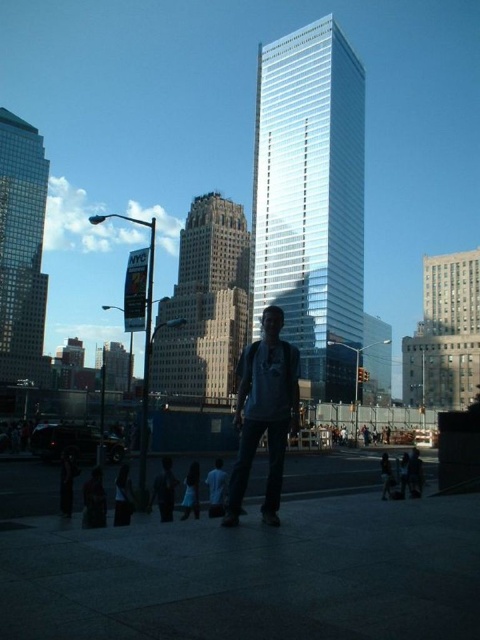
Question: Is glassy silver skyscraper at center wider than shiny glass skyscraper at left?

Choices:
 (A) no
 (B) yes

Answer: (B)

Question: Among these objects, which one is farthest from the camera?

Choices:
 (A) gray cotton t-shirt at center
 (B) glassy silver skyscraper at center
 (C) brown stone building at center
 (D) shiny glass skyscraper at left

Answer: (D)

Question: Can you confirm if brown stone building at center is positioned to the left of gray concrete building at right?

Choices:
 (A) no
 (B) yes

Answer: (B)

Question: Which object is farther from the camera taking this photo?

Choices:
 (A) gray cotton t-shirt at center
 (B) brown stone building at center
 (C) gray concrete building at right

Answer: (B)

Question: Which object appears farthest from the camera in this image?

Choices:
 (A) gray cotton t-shirt at center
 (B) glassy silver skyscraper at center
 (C) gray concrete building at right
 (D) shiny glass skyscraper at left

Answer: (D)

Question: Is shiny glass skyscraper at left wider than gray concrete building at right?

Choices:
 (A) yes
 (B) no

Answer: (B)